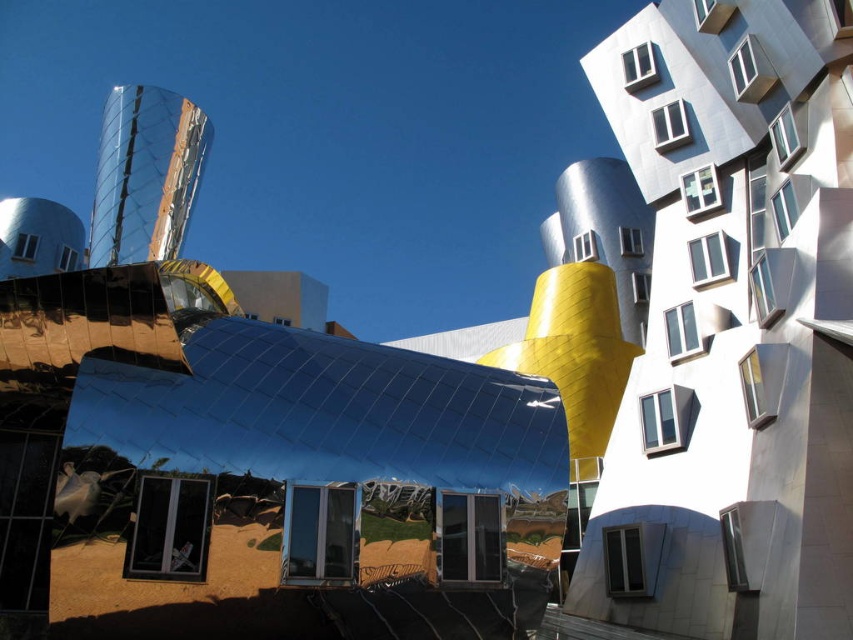
You are standing at the center of the futuristic building and looking towards the point marked at coordinates (732, 324). What structure or feature do you see in that direction?

The point at coordinates (732, 324) indicates the metallic silver building at center, so looking towards that direction from the center would mean you are looking at the building itself.

Based on the photo, you are an architect standing in front of the futuristic building. You notice the metallic silver building at center and the matte glass window at center. Which object is nearer to you?

The metallic silver building at center is closer to the viewer than the matte glass window at center.

You are an architect reviewing the design of the metallic silver building at center and the matte glass window at center. Based on the provided image, which object is located above the other?

The metallic silver building at center is positioned over the matte glass window at center, meaning it is above the window.